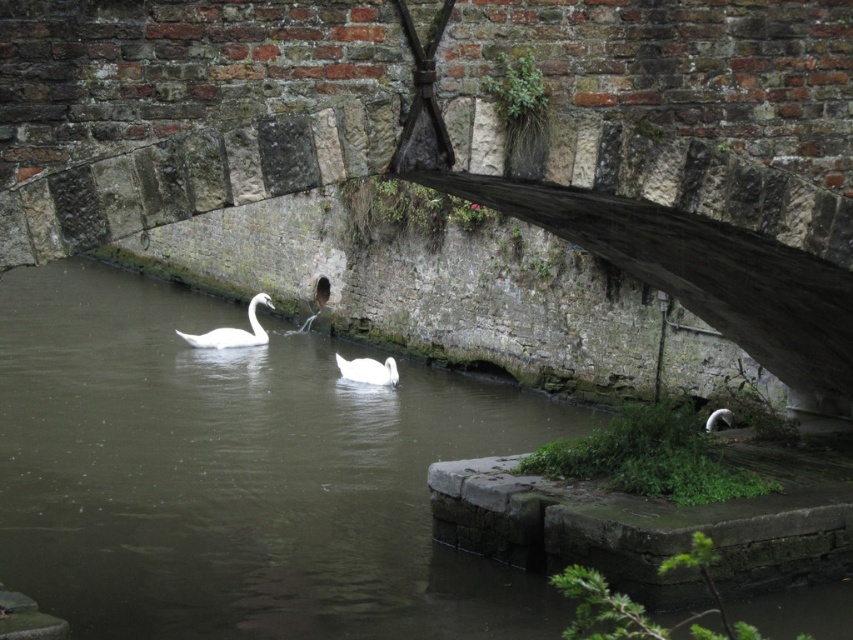
Question: Among these points, which one is nearest to the camera?

Choices:
 (A) (375, 372)
 (B) (350, 404)
 (C) (244, 342)

Answer: (B)

Question: Does clear water at center appear on the right side of white glossy swan at left?

Choices:
 (A) no
 (B) yes

Answer: (A)

Question: Does white glossy swan at left have a larger size compared to white glossy swan at center?

Choices:
 (A) no
 (B) yes

Answer: (B)

Question: From the image, what is the correct spatial relationship of white glossy swan at left in relation to white glossy swan at center?

Choices:
 (A) left
 (B) right

Answer: (A)

Question: Which point is farther to the camera?

Choices:
 (A) clear water at center
 (B) white glossy swan at center

Answer: (B)

Question: Estimate the real-world distances between objects in this image. Which object is closer to the clear water at center?

Choices:
 (A) white glossy swan at left
 (B) white glossy swan at center

Answer: (B)